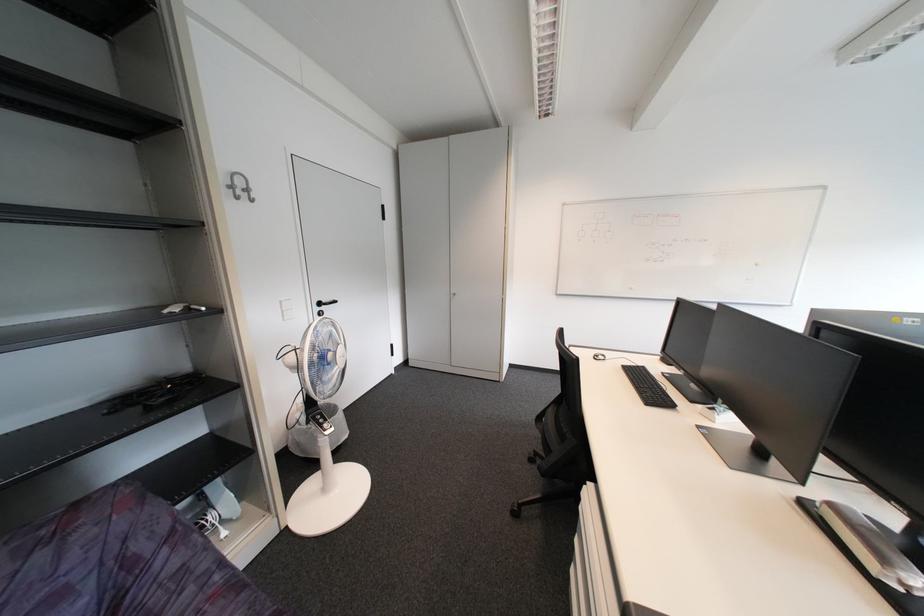
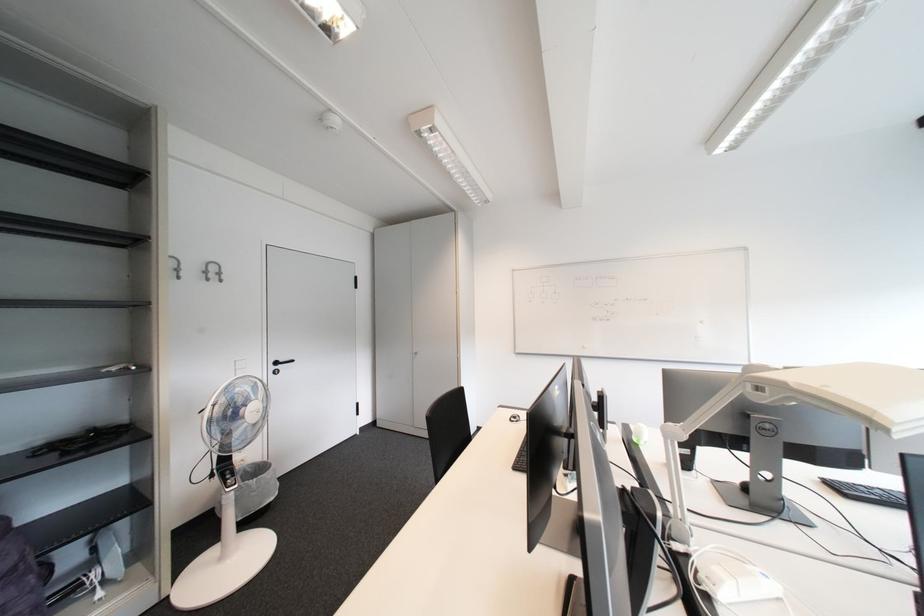
Question: Which direction would the cameraman need to move to produce the second image? Reply with the corresponding letter.

Choices:
 (A) Left
 (B) Right
 (C) Forward
 (D) Backward

Answer: (B)